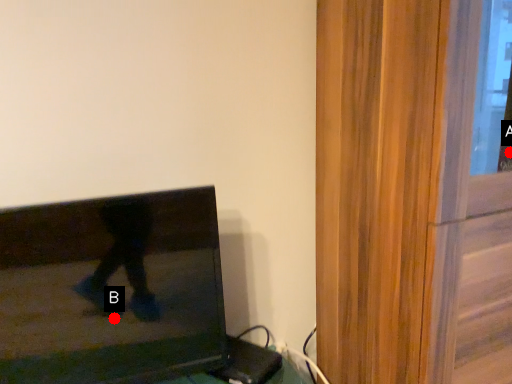
Question: Two points are circled on the image, labeled by A and B beside each circle. Which of the following is the closest to the observer?

Choices:
 (A) A is closer
 (B) B is closer

Answer: (B)